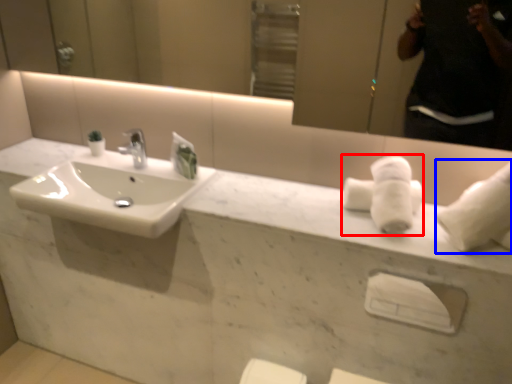
Question: Which object appears farthest to the camera in this image, bath towel (highlighted by a red box) or bath towel (highlighted by a blue box)?

Choices:
 (A) bath towel
 (B) bath towel

Answer: (A)